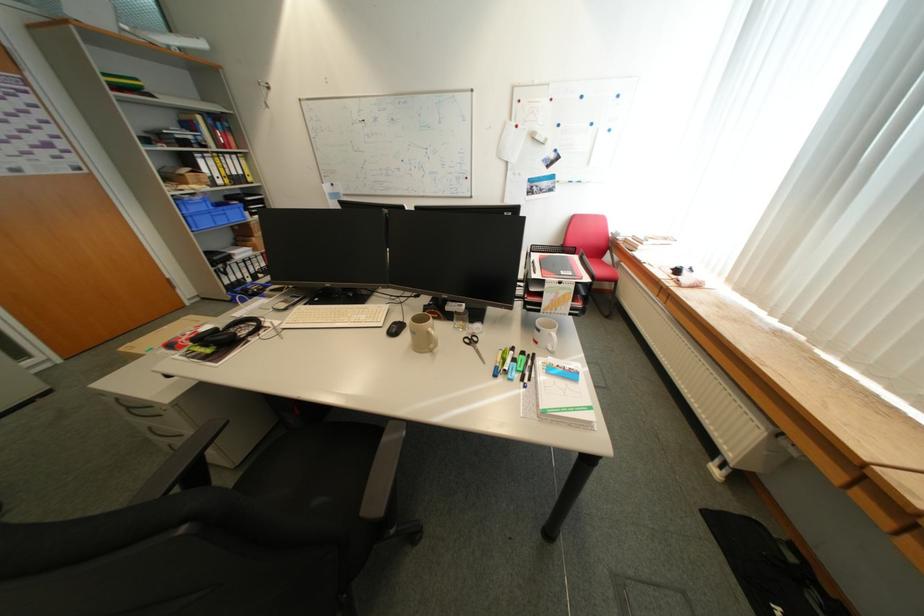
Where is `red binder`? The image size is (924, 616). red binder is located at coordinates (555, 277).